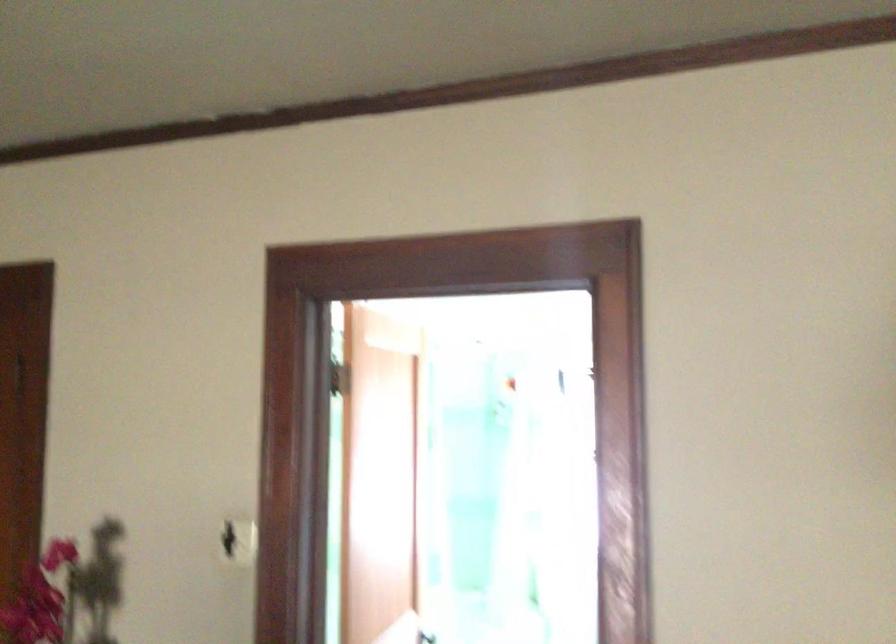
Find where to flip the black light switch. Please return your answer as a coordinate pair (x, y).

(228, 540)